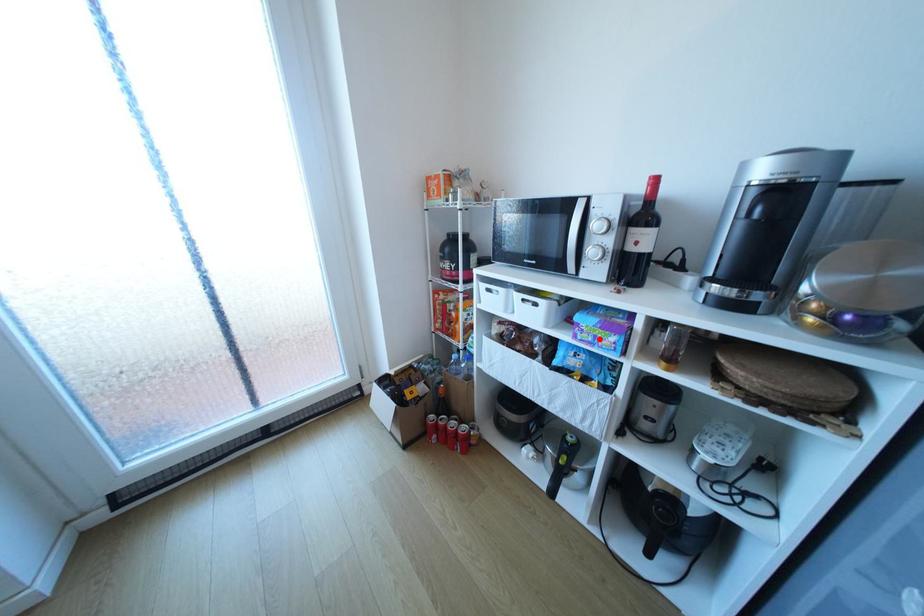
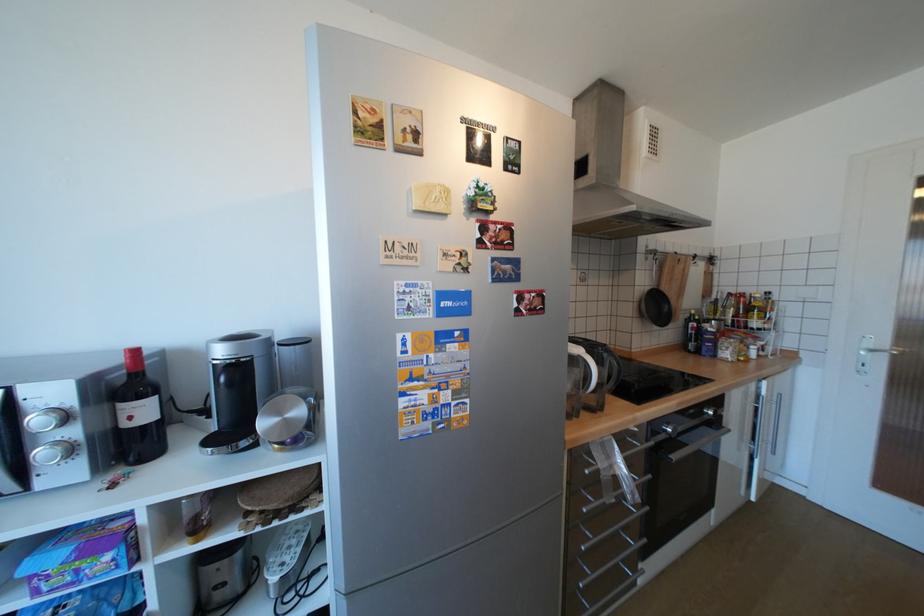
Find the pixel in the second image that matches the highlighted location in the first image.

(79, 578)